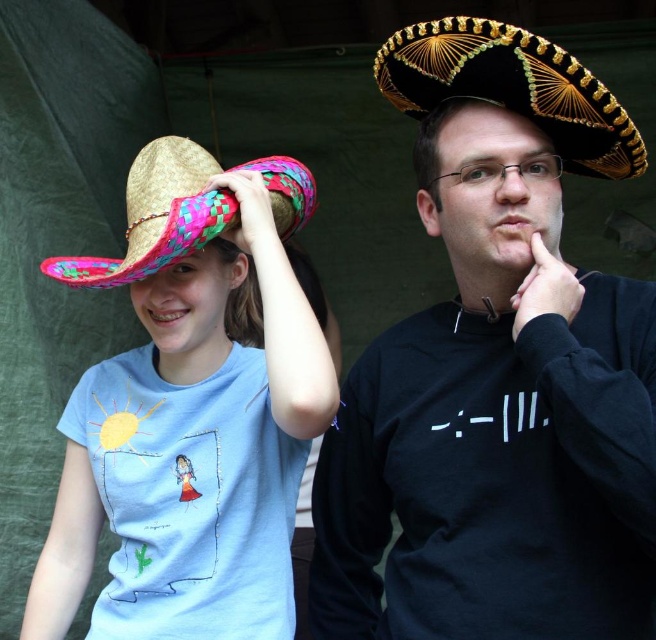
Can you confirm if bright straw hat at left is wider than black straw sombrero at upper right?

Indeed, bright straw hat at left has a greater width compared to black straw sombrero at upper right.

The height and width of the screenshot is (640, 656). Describe the element at coordinates (190, 413) in the screenshot. I see `bright straw hat at left` at that location.

The height and width of the screenshot is (640, 656). What are the coordinates of `bright straw hat at left` in the screenshot? It's located at (190, 413).

Between black matte sombrero at center and bright straw hat at left, which one appears on the left side from the viewer's perspective?

bright straw hat at left

Is point (560, 570) positioned in front of point (154, 614)?

Yes, point (560, 570) is closer to viewer.

Locate an element on the screen. black matte sombrero at center is located at coordinates (497, 374).

Does point (594, 122) come closer to viewer compared to point (119, 269)?

No, (594, 122) is behind (119, 269).

Can you confirm if black straw sombrero at upper right is positioned to the left of bright pink woven straw cowboy hat at upper left?

Incorrect, black straw sombrero at upper right is not on the left side of bright pink woven straw cowboy hat at upper left.

Identify the location of black straw sombrero at upper right. coord(512,88).